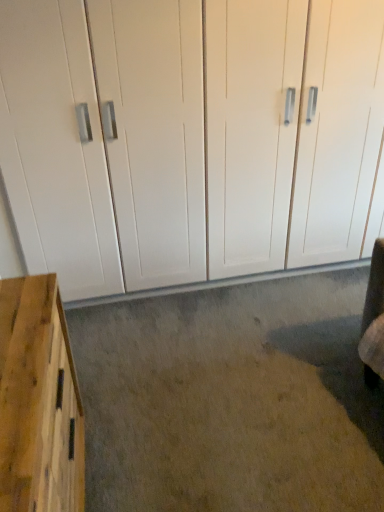
Consider the image. What is the approximate height of wooden drawer at left?

29.57 inches.

The width and height of the screenshot is (384, 512). What do you see at coordinates (38, 402) in the screenshot? I see `wooden drawer at left` at bounding box center [38, 402].

In order to face wooden drawer at left, should I rotate leftwards or rightwards?

Rotate your view left by about 23.386°.

Measure the distance between point (x=65, y=323) and camera.

They are 7.60 feet apart.

The height and width of the screenshot is (512, 384). I want to click on wooden drawer at left, so click(38, 402).

At what (x,y) coordinates should I click in order to perform the action: click on wooden drawer at left. Please return your answer as a coordinate pair (x, y). The image size is (384, 512). Looking at the image, I should click on [38, 402].